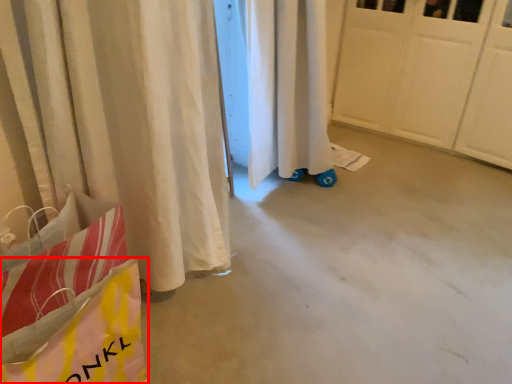
Question: From the image's perspective, considering the relative positions of grocery bag (annotated by the red box) and concrete in the image provided, where is grocery bag (annotated by the red box) located with respect to the staircase?

Choices:
 (A) below
 (B) above

Answer: (A)